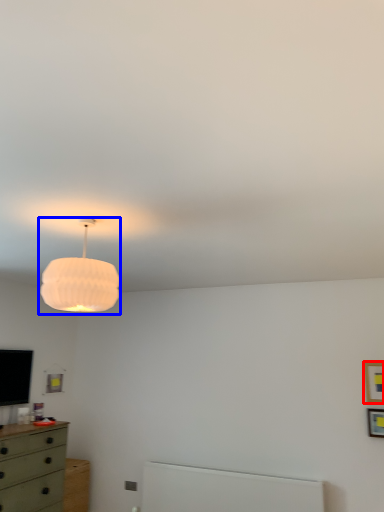
Question: Which of the following is the farthest to the observer, picture frame (highlighted by a red box) or lamp (highlighted by a blue box)?

Choices:
 (A) picture frame
 (B) lamp

Answer: (A)